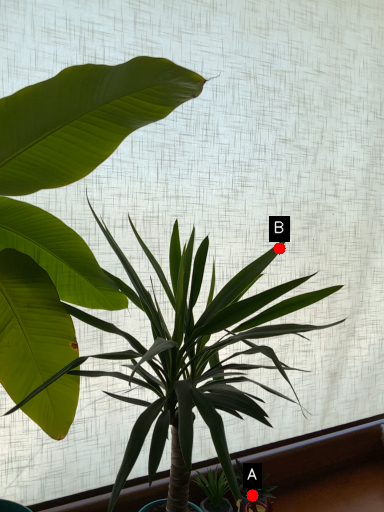
Question: Two points are circled on the image, labeled by A and B beside each circle. Among these points, which one is nearest to the camera?

Choices:
 (A) A is closer
 (B) B is closer

Answer: (B)